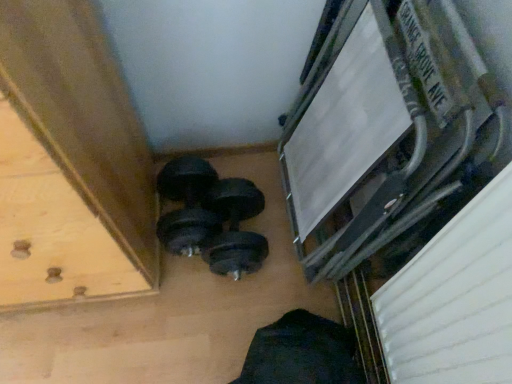
Question: From a real-world perspective, is black rubber dumbbell at center, the 1th dumbbell viewed from the right, below black rubber dumbbell at lower center, which is counted as the first dumbbell, starting from the left?

Choices:
 (A) no
 (B) yes

Answer: (B)

Question: Does black rubber dumbbell at center, which is the 2th dumbbell in left-to-right order, appear on the right side of black rubber dumbbell at lower center, which is counted as the first dumbbell, starting from the left?

Choices:
 (A) yes
 (B) no

Answer: (A)

Question: Would you say black rubber dumbbell at center, the 1th dumbbell viewed from the right, contains black rubber dumbbell at lower center, the 2th dumbbell from the right?

Choices:
 (A) yes
 (B) no

Answer: (A)

Question: Is black rubber dumbbell at center, which is the 2th dumbbell in left-to-right order, closer to the viewer compared to black rubber dumbbell at lower center, the 2th dumbbell from the right?

Choices:
 (A) no
 (B) yes

Answer: (B)

Question: Is black rubber dumbbell at center, which is the 2th dumbbell in left-to-right order, shorter than black rubber dumbbell at lower center, the 2th dumbbell from the right?

Choices:
 (A) yes
 (B) no

Answer: (A)

Question: Does black rubber dumbbell at center, which is the 2th dumbbell in left-to-right order, lie behind black rubber dumbbell at lower center, the 2th dumbbell from the right?

Choices:
 (A) no
 (B) yes

Answer: (A)

Question: Does wooden drawer at lower left have a lesser height compared to black rubber dumbbell at center, the 1th dumbbell viewed from the right?

Choices:
 (A) no
 (B) yes

Answer: (A)

Question: Is wooden drawer at lower left next to black rubber dumbbell at center, which is the 2th dumbbell in left-to-right order, and touching it?

Choices:
 (A) yes
 (B) no

Answer: (B)

Question: Is black rubber dumbbell at center, which is the 2th dumbbell in left-to-right order, located within wooden drawer at lower left?

Choices:
 (A) no
 (B) yes

Answer: (A)

Question: Can you confirm if wooden drawer at lower left is bigger than black rubber dumbbell at center, the 1th dumbbell viewed from the right?

Choices:
 (A) no
 (B) yes

Answer: (B)

Question: Is wooden drawer at lower left smaller than black rubber dumbbell at center, which is the 2th dumbbell in left-to-right order?

Choices:
 (A) no
 (B) yes

Answer: (A)

Question: From a real-world perspective, is wooden drawer at lower left beneath black rubber dumbbell at center, which is the 2th dumbbell in left-to-right order?

Choices:
 (A) yes
 (B) no

Answer: (B)

Question: Does black rubber dumbbell at center, the 1th dumbbell viewed from the right, appear on the right side of wooden drawer at lower left?

Choices:
 (A) no
 (B) yes

Answer: (B)